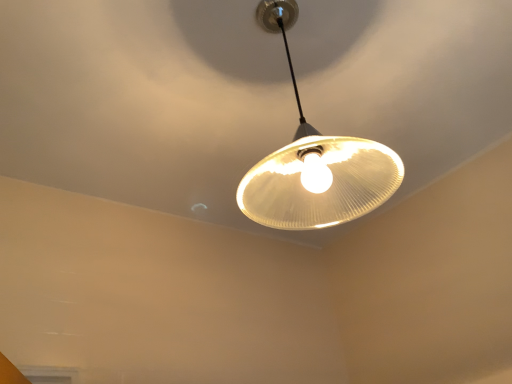
This screenshot has height=384, width=512. Find the location of `matte white lampshade at center`. matte white lampshade at center is located at coordinates (315, 164).

The height and width of the screenshot is (384, 512). Describe the element at coordinates (315, 164) in the screenshot. I see `matte white lampshade at center` at that location.

Where is `matte white lampshade at center`? matte white lampshade at center is located at coordinates (315, 164).